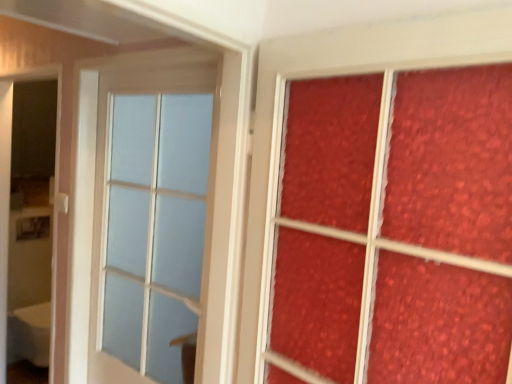
Question: In terms of height, does white glossy screen door at left look taller or shorter compared to matte textured glass at right?

Choices:
 (A) tall
 (B) short

Answer: (A)

Question: Is white glossy screen door at left in front of or behind matte textured glass at right in the image?

Choices:
 (A) behind
 (B) front

Answer: (A)

Question: Estimate the real-world distances between objects in this image. Which object is farther from the matte textured glass at right?

Choices:
 (A) white glossy screen door at left
 (B) white plastic door handle at upper left
 (C) matte glass window at center

Answer: (A)

Question: Which of these objects is positioned closest to the matte glass window at center?

Choices:
 (A) matte textured glass at right
 (B) white plastic door handle at upper left
 (C) white glossy screen door at left

Answer: (C)